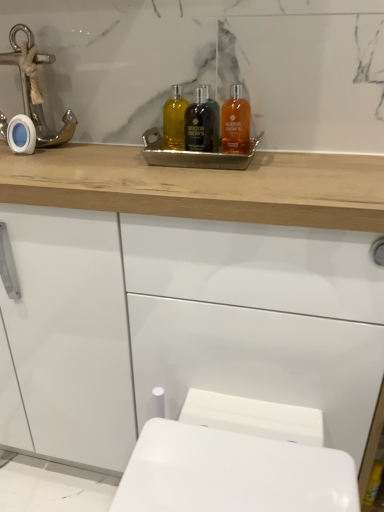
What do you see at coordinates (30, 95) in the screenshot?
I see `metallic anchor at left` at bounding box center [30, 95].

Image resolution: width=384 pixels, height=512 pixels. Describe the element at coordinates (199, 145) in the screenshot. I see `metallic tray at center` at that location.

Measure the distance between point [230,110] and camera.

Point [230,110] is 38.58 inches away from camera.

Based on the photo, measure the distance between point (242, 219) and camera.

Point (242, 219) is 70.70 centimeters from camera.

In order to face translucent amber liquid at center, marked as the 3th mouthwash in a right-to-left arrangement, should I rotate leftwards or rightwards?

A 2.357 degree turn to the left will do.

Image resolution: width=384 pixels, height=512 pixels. I want to click on black glass bottle at center, arranged as the 2th mouthwash when viewed from the left, so click(x=199, y=124).

Locate an element on the screen. The image size is (384, 512). metallic anchor at left is located at coordinates (30, 95).

From a real-world perspective, who is located lower, white glossy cabinet at upper center or metallic tray at center?

From a 3D spatial view, white glossy cabinet at upper center is below.

Is white glossy cabinet at upper center shorter than metallic tray at center?

Incorrect, the height of white glossy cabinet at upper center does not fall short of that of metallic tray at center.

Image resolution: width=384 pixels, height=512 pixels. What are the coordinates of `sink above the white glossy cabinet at upper center (from a real-world perspective)` in the screenshot? It's located at (199, 145).

Is white glossy cabinet at upper center smaller than metallic tray at center?

Actually, white glossy cabinet at upper center might be larger than metallic tray at center.

Considering the sizes of objects white glossy cabinet at upper center and white glossy porcelain at lower center in the image provided, who is shorter, white glossy cabinet at upper center or white glossy porcelain at lower center?

With less height is white glossy porcelain at lower center.

Considering the relative positions of white glossy cabinet at upper center and white glossy porcelain at lower center in the image provided, is white glossy cabinet at upper center to the right of white glossy porcelain at lower center from the viewer's perspective?

Incorrect, white glossy cabinet at upper center is not on the right side of white glossy porcelain at lower center.

Is white glossy cabinet at upper center with white glossy porcelain at lower center?

They are not placed beside each other.

Does point (206, 213) come behind point (191, 408)?

No, it is not.

What's the angular difference between white glossy cabinet at upper center and metallic anchor at left's facing directions?

0.0221 degrees.

Is metallic anchor at left at the back of white glossy cabinet at upper center?

No, white glossy cabinet at upper center is not facing the opposite direction of metallic anchor at left.

Measure the distance from white glossy cabinet at upper center to metallic anchor at left.

They are 14.44 inches apart.

Does white glossy cabinet at upper center come behind metallic anchor at left?

No, white glossy cabinet at upper center is closer to the viewer.

Between black glass bottle at center, the 2th mouthwash from the right, and translucent amber liquid at center, marked as the 3th mouthwash in a right-to-left arrangement, which one appears on the left side from the viewer's perspective?

translucent amber liquid at center, marked as the 3th mouthwash in a right-to-left arrangement.

Is black glass bottle at center, arranged as the 2th mouthwash when viewed from the left, inside the boundaries of translucent amber liquid at center, marked as the 3th mouthwash in a right-to-left arrangement, or outside?

black glass bottle at center, arranged as the 2th mouthwash when viewed from the left, cannot be found inside translucent amber liquid at center, marked as the 3th mouthwash in a right-to-left arrangement.

Looking at this image, from the image's perspective, relative to translucent amber liquid at center, the 1th mouthwash positioned from the left, is black glass bottle at center, the 2th mouthwash from the right, above or below?

From the image's perspective, black glass bottle at center, the 2th mouthwash from the right, appears below translucent amber liquid at center, the 1th mouthwash positioned from the left.

From a real-world perspective, is black glass bottle at center, the 2th mouthwash from the right, physically located above or below translucent amber liquid at center, the 1th mouthwash positioned from the left?

black glass bottle at center, the 2th mouthwash from the right, is above translucent amber liquid at center, the 1th mouthwash positioned from the left.

In order to click on the 2nd mouthwash to the left of the white glossy porcelain at lower center, counting from the anchor's position in this screenshot , I will do `click(199, 124)`.

Is black glass bottle at center, arranged as the 2th mouthwash when viewed from the left, not within white glossy porcelain at lower center?

Yes, black glass bottle at center, arranged as the 2th mouthwash when viewed from the left, is not within white glossy porcelain at lower center.

Is point (210, 111) more distant than point (122, 508)?

Yes, it is.

Considering the sizes of objects black glass bottle at center, the 2th mouthwash from the right, and white glossy porcelain at lower center in the image provided, who is smaller, black glass bottle at center, the 2th mouthwash from the right, or white glossy porcelain at lower center?

black glass bottle at center, the 2th mouthwash from the right.

How many degrees apart are the facing directions of metallic anchor at left and translucent amber liquid at upper center, the third mouthwash viewed from the left?

The facing directions of metallic anchor at left and translucent amber liquid at upper center, the third mouthwash viewed from the left, are 0.00278 degrees apart.

Is point (72, 120) positioned after point (238, 133)?

Yes, it is.

Choose the correct answer: Is metallic anchor at left inside translucent amber liquid at upper center, the third mouthwash viewed from the left, or outside it?

metallic anchor at left is outside translucent amber liquid at upper center, the third mouthwash viewed from the left.

Could you tell me if translucent amber liquid at center, the 1th mouthwash positioned from the left, is turned towards metallic tray at center?

No, translucent amber liquid at center, the 1th mouthwash positioned from the left, is not facing towards metallic tray at center.

Does translucent amber liquid at center, the 1th mouthwash positioned from the left, appear on the left side of metallic tray at center?

Indeed, translucent amber liquid at center, the 1th mouthwash positioned from the left, is positioned on the left side of metallic tray at center.

Considering the relative sizes of translucent amber liquid at center, the 1th mouthwash positioned from the left, and metallic tray at center in the image provided, is translucent amber liquid at center, the 1th mouthwash positioned from the left, thinner than metallic tray at center?

Yes, translucent amber liquid at center, the 1th mouthwash positioned from the left, is thinner than metallic tray at center.

You are a GUI agent. You are given a task and a screenshot of the screen. Output one action in this format:
    pyautogui.click(x=<x>, y=<y>)
    Task: Click on the bathroom cabinet located underneath the metallic tray at center (from a real-world perspective)
    
    Given the screenshot: What is the action you would take?
    pyautogui.click(x=203, y=186)

Locate an element on the screen. The width and height of the screenshot is (384, 512). bathroom cabinet above the white glossy porcelain at lower center (from the image's perspective) is located at coordinates (203, 186).

Estimate the real-world distances between objects in this image. Which object is closer to white glossy cabinet at upper center, translucent amber liquid at upper center, the 1th mouthwash when ordered from right to left, or metallic tray at center?

Based on the image, metallic tray at center appears to be nearer to white glossy cabinet at upper center.

Based on their spatial positions, is metallic anchor at left or metallic tray at center further from white glossy cabinet at upper center?

metallic anchor at left is further to white glossy cabinet at upper center.

Looking at the image, which one is located further to metallic anchor at left, translucent amber liquid at center, marked as the 3th mouthwash in a right-to-left arrangement, or white glossy porcelain at lower center?

white glossy porcelain at lower center is positioned further to the anchor metallic anchor at left.

Looking at the image, which one is located closer to metallic tray at center, white glossy cabinet at upper center or translucent amber liquid at upper center, the third mouthwash viewed from the left?

translucent amber liquid at upper center, the third mouthwash viewed from the left, is positioned closer to the anchor metallic tray at center.

Based on their spatial positions, is white glossy cabinet at upper center or translucent amber liquid at center, marked as the 3th mouthwash in a right-to-left arrangement, closer to white glossy porcelain at lower center?

white glossy cabinet at upper center is closer to white glossy porcelain at lower center.

Which object lies further to the anchor point metallic anchor at left, white glossy cabinet at upper center or white glossy porcelain at lower center?

Among the two, white glossy porcelain at lower center is located further to metallic anchor at left.

From the image, which object appears to be nearer to metallic tray at center, black glass bottle at center, the 2th mouthwash from the right, or metallic anchor at left?

Among the two, black glass bottle at center, the 2th mouthwash from the right, is located nearer to metallic tray at center.

Which object lies further to the anchor point metallic tray at center, translucent amber liquid at upper center, the third mouthwash viewed from the left, or white glossy cabinet at upper center?

Among the two, white glossy cabinet at upper center is located further to metallic tray at center.

This screenshot has height=512, width=384. Find the location of `sink situated between metallic anchor at left and black glass bottle at center, the 2th mouthwash from the right, from left to right`. sink situated between metallic anchor at left and black glass bottle at center, the 2th mouthwash from the right, from left to right is located at coordinates (199, 145).

Locate an element on the screen. This screenshot has width=384, height=512. sink between metallic anchor at left and white glossy cabinet at upper center in the vertical direction is located at coordinates (199, 145).

The width and height of the screenshot is (384, 512). I want to click on sink between translucent amber liquid at center, the 1th mouthwash positioned from the left, and black glass bottle at center, arranged as the 2th mouthwash when viewed from the left, in the horizontal direction, so click(x=199, y=145).

Find the location of a particular element. This screenshot has width=384, height=512. sink between black glass bottle at center, the 2th mouthwash from the right, and white glossy porcelain at lower center, in the vertical direction is located at coordinates (199, 145).